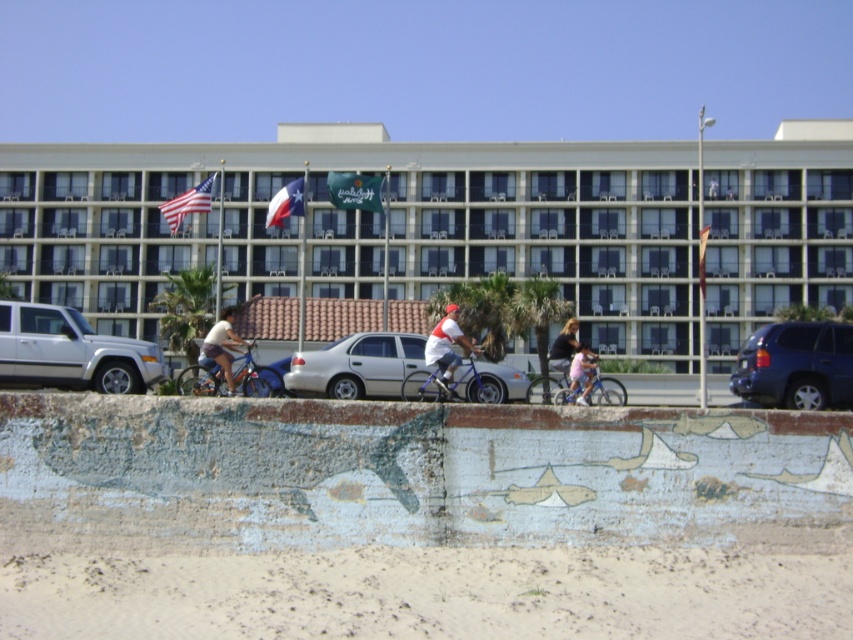
Question: Which object is the closest to the blue metallic bicycle at center?

Choices:
 (A) silver metallic truck at left
 (B) matte blue shorts at center

Answer: (A)

Question: Which point appears farthest from the camera in this image?

Choices:
 (A) (526, 394)
 (B) (163, 205)

Answer: (B)

Question: Considering the relative positions of white glass building at center and american flag at upper left in the image provided, where is white glass building at center located with respect to american flag at upper left?

Choices:
 (A) left
 (B) right

Answer: (B)

Question: Does pink matte bicycle at center appear on the right side of matte blue shorts at center?

Choices:
 (A) no
 (B) yes

Answer: (B)

Question: Which of the following is the closest to the observer?

Choices:
 (A) pink fabric dress at center
 (B) green fabric flag at upper center
 (C) white glass building at center

Answer: (A)

Question: From the image, what is the correct spatial relationship of american flag at upper left in relation to light blue denim shorts at center?

Choices:
 (A) left
 (B) right

Answer: (A)